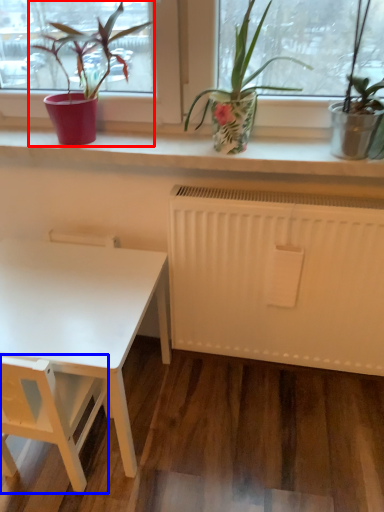
Question: Among these objects, which one is nearest to the camera, houseplant (highlighted by a red box) or armchair (highlighted by a blue box)?

Choices:
 (A) houseplant
 (B) armchair

Answer: (B)